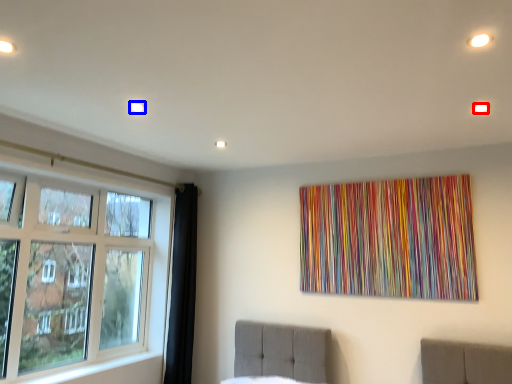
Question: Among these objects, which one is nearest to the camera, light (highlighted by a red box) or light (highlighted by a blue box)?

Choices:
 (A) light
 (B) light

Answer: (A)